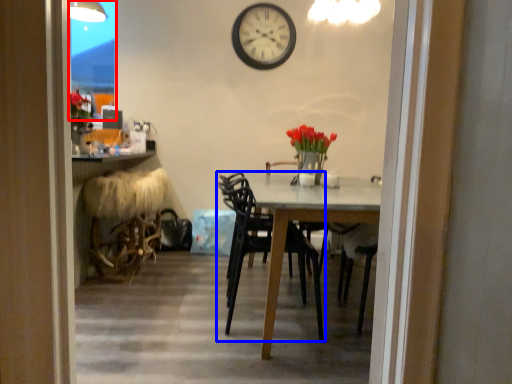
Question: Which object appears farthest to the camera in this image, glass door (highlighted by a red box) or chair (highlighted by a blue box)?

Choices:
 (A) glass door
 (B) chair

Answer: (A)